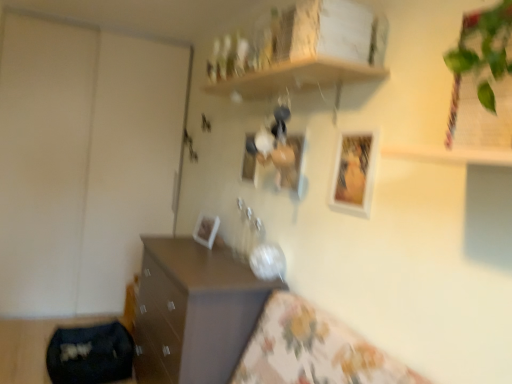
Question: Is the depth of matte brown chest of drawers at lower left less than that of matte white picture frame at center, which is the 3th picture frame from back to front?

Choices:
 (A) yes
 (B) no

Answer: (A)

Question: Does matte brown chest of drawers at lower left have a greater width compared to matte white picture frame at center, which is the 2th picture frame in front-to-back order?

Choices:
 (A) yes
 (B) no

Answer: (A)

Question: From the image's perspective, is matte brown chest of drawers at lower left located beneath matte white picture frame at center, the third picture frame positioned from the left?

Choices:
 (A) yes
 (B) no

Answer: (A)

Question: From a real-world perspective, is matte brown chest of drawers at lower left physically above matte white picture frame at center, which is the 3th picture frame from back to front?

Choices:
 (A) no
 (B) yes

Answer: (A)

Question: Does matte brown chest of drawers at lower left have a larger size compared to matte white picture frame at center, which is the 3th picture frame from back to front?

Choices:
 (A) no
 (B) yes

Answer: (B)

Question: From a real-world perspective, is white glossy picture frame at upper center, positioned as the fourth picture frame in left-to-right order, above or below white plastic picture frame at center, the 1th picture frame positioned from the left?

Choices:
 (A) above
 (B) below

Answer: (A)

Question: Is white glossy picture frame at upper center, acting as the fourth picture frame starting from the back, wider or thinner than white plastic picture frame at center, marked as the 4th picture frame in a front-to-back arrangement?

Choices:
 (A) wide
 (B) thin

Answer: (B)

Question: In terms of height, does white glossy picture frame at upper center, acting as the fourth picture frame starting from the back, look taller or shorter compared to white plastic picture frame at center, marked as the 4th picture frame in a front-to-back arrangement?

Choices:
 (A) tall
 (B) short

Answer: (A)

Question: Which is correct: white glossy picture frame at upper center, the 1th picture frame when ordered from front to back, is inside white plastic picture frame at center, the 1th picture frame positioned from the left, or outside of it?

Choices:
 (A) outside
 (B) inside

Answer: (A)

Question: From a real-world perspective, is matte white picture frame at center, which is the 2th picture frame in front-to-back order, above or below white glossy picture frame at upper center, placed as the 1th picture frame when sorted from right to left?

Choices:
 (A) above
 (B) below

Answer: (A)

Question: Does point (279, 170) appear closer or farther from the camera than point (332, 173)?

Choices:
 (A) farther
 (B) closer

Answer: (A)

Question: Is matte white picture frame at center, which is the 2th picture frame in front-to-back order, wider or thinner than white glossy picture frame at upper center, placed as the 1th picture frame when sorted from right to left?

Choices:
 (A) wide
 (B) thin

Answer: (A)

Question: Considering their positions, is matte white picture frame at center, the third picture frame positioned from the left, located in front of or behind white glossy picture frame at upper center, placed as the 1th picture frame when sorted from right to left?

Choices:
 (A) behind
 (B) front

Answer: (A)

Question: From a real-world perspective, is white glossy picture frame at upper center, positioned as the fourth picture frame in left-to-right order, positioned above or below wooden shelf at upper center?

Choices:
 (A) above
 (B) below

Answer: (B)

Question: Is white glossy picture frame at upper center, positioned as the fourth picture frame in left-to-right order, in front of or behind wooden shelf at upper center in the image?

Choices:
 (A) front
 (B) behind

Answer: (B)